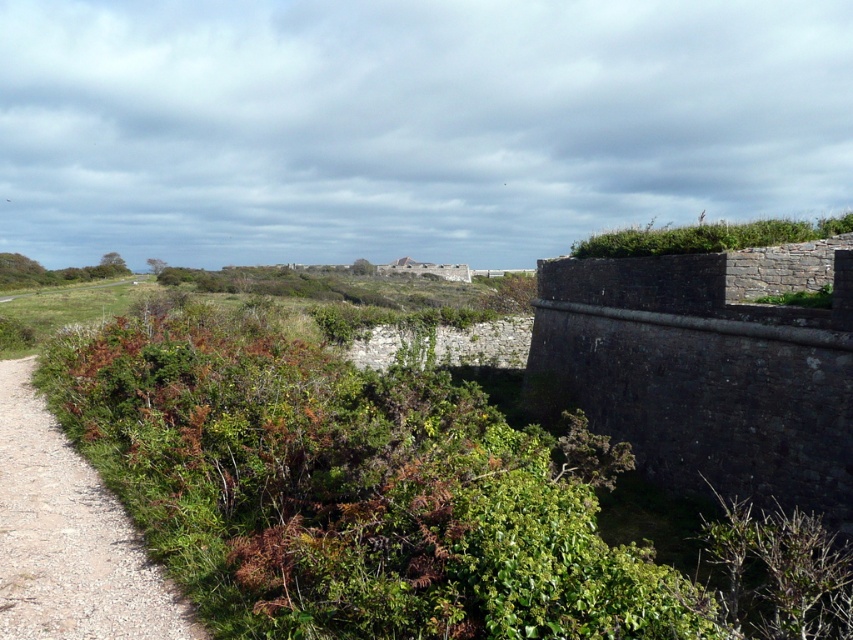
Question: Among these objects, which one is nearest to the camera?

Choices:
 (A) green leafy trail at left
 (B) dark gray stone wall at right

Answer: (A)

Question: Which of these objects is positioned farthest from the green leafy shrub at upper right?

Choices:
 (A) dark gray stone wall at right
 (B) green leafy trail at left

Answer: (B)

Question: From the image, what is the correct spatial relationship of dark gray stone wall at right in relation to green leafy trail at left?

Choices:
 (A) right
 (B) left

Answer: (A)

Question: Does green leafy trail at left lie in front of green leafy shrub at upper right?

Choices:
 (A) no
 (B) yes

Answer: (B)

Question: Which of the following is the closest to the observer?

Choices:
 (A) (659, 228)
 (B) (757, 326)

Answer: (B)

Question: Is green leafy trail at left positioned before green leafy shrub at upper right?

Choices:
 (A) no
 (B) yes

Answer: (B)